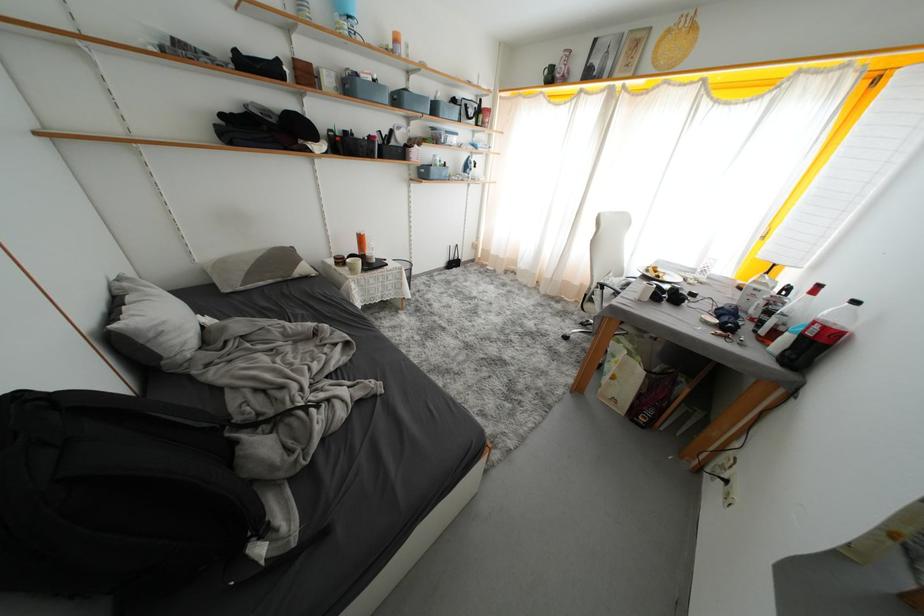
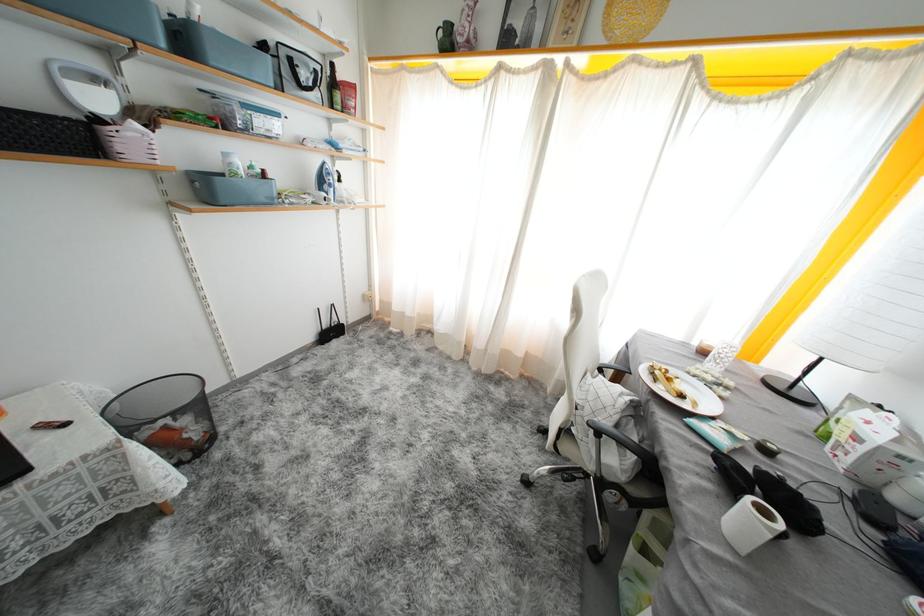
Where in the second image is the point corresponding to the point at 553,76 from the first image?

(446, 37)